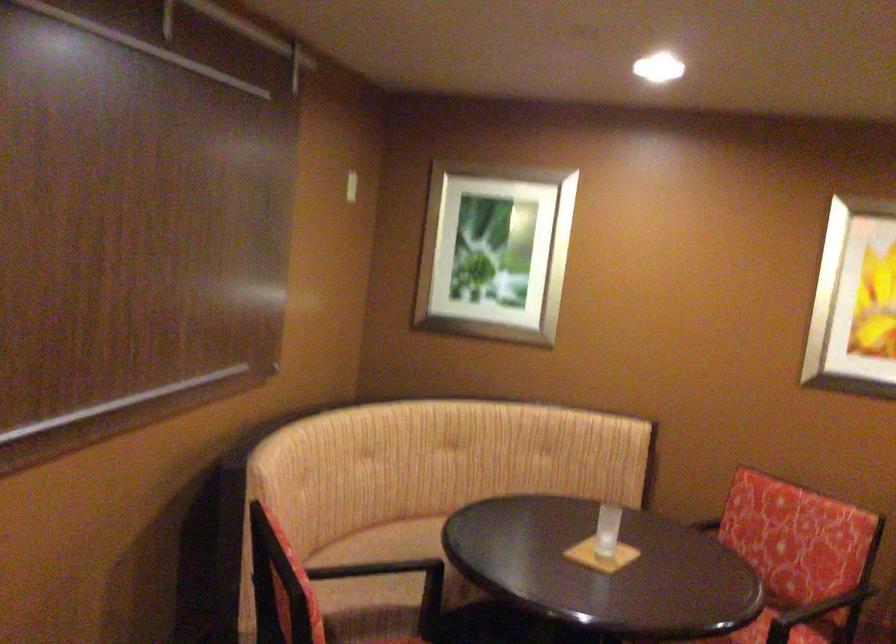
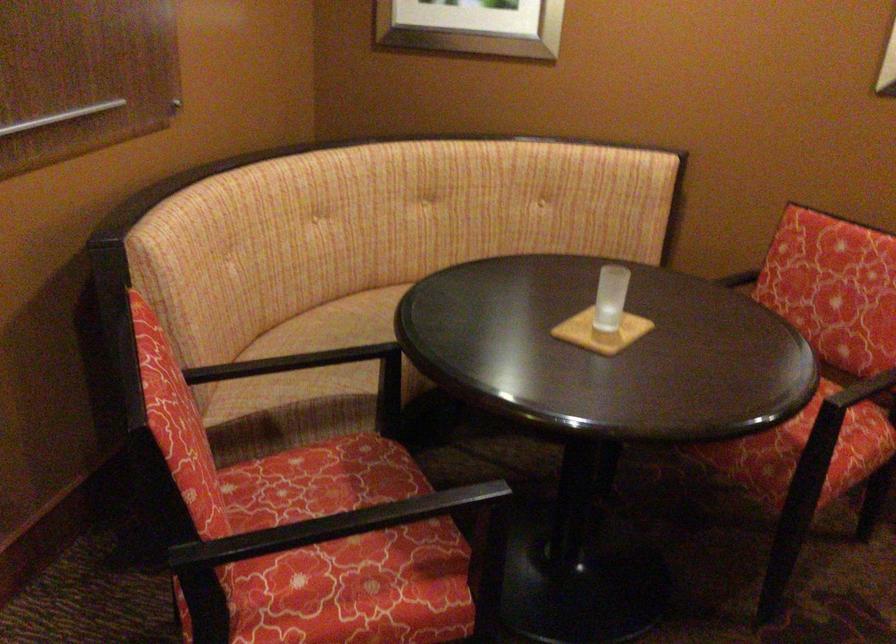
In the second image, find the point that corresponds to pixel 385 567 in the first image.

(337, 343)